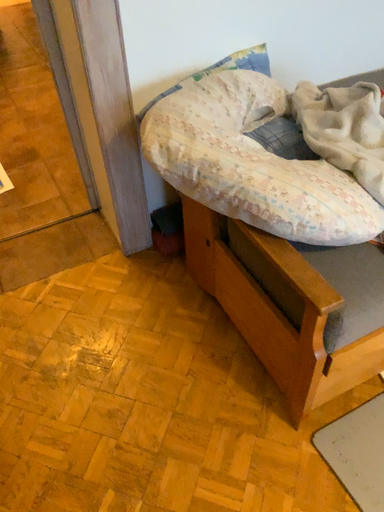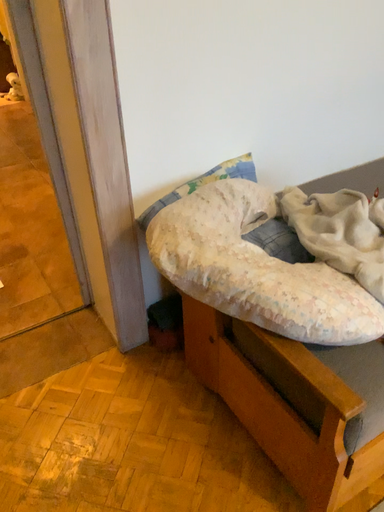
Question: How did the camera likely rotate when shooting the video?

Choices:
 (A) rotated upward
 (B) rotated downward

Answer: (A)